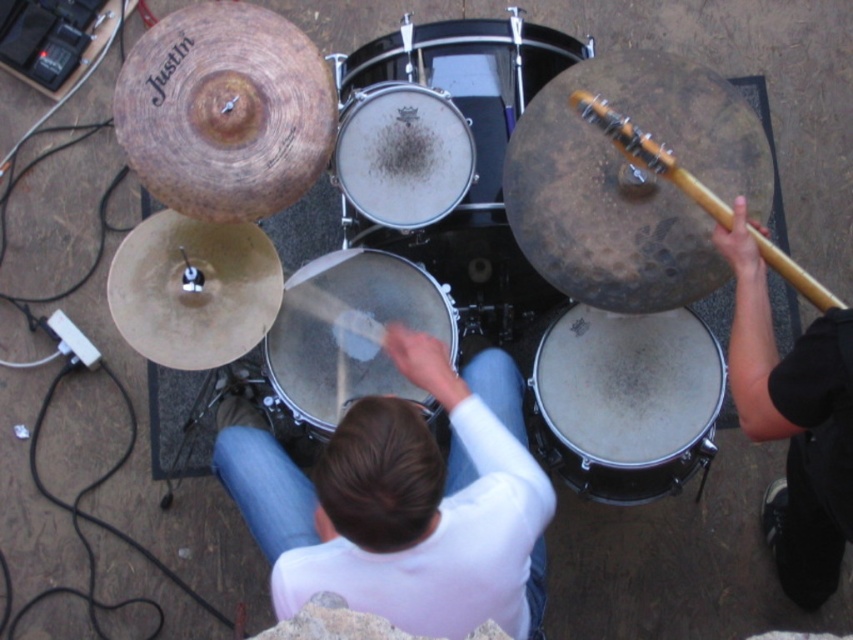
Is white matte drum at lower right in front of smooth black drum at center?

No, it is behind smooth black drum at center.

Is white matte drum at lower right shorter than smooth black drum at center?

Yes, white matte drum at lower right is shorter than smooth black drum at center.

At what (x,y) coordinates should I click in order to perform the action: click on white matte drum at lower right. Please return your answer as a coordinate pair (x, y). The width and height of the screenshot is (853, 640). Looking at the image, I should click on (625, 401).

Can you confirm if black fabric arm at right is thinner than silver metallic drum at center?

Incorrect, black fabric arm at right's width is not less than silver metallic drum at center's.

How much distance is there between black fabric arm at right and silver metallic drum at center?

black fabric arm at right and silver metallic drum at center are 85.56 centimeters apart.

Locate an element on the screen. This screenshot has width=853, height=640. black fabric arm at right is located at coordinates (793, 420).

Which is more to the right, black fabric arm at right or smooth black drum at center?

Positioned to the right is black fabric arm at right.

Does black fabric arm at right have a smaller size compared to smooth black drum at center?

No.

In order to click on black fabric arm at right in this screenshot , I will do `click(793, 420)`.

Where is `black fabric arm at right`? This screenshot has height=640, width=853. black fabric arm at right is located at coordinates (x=793, y=420).